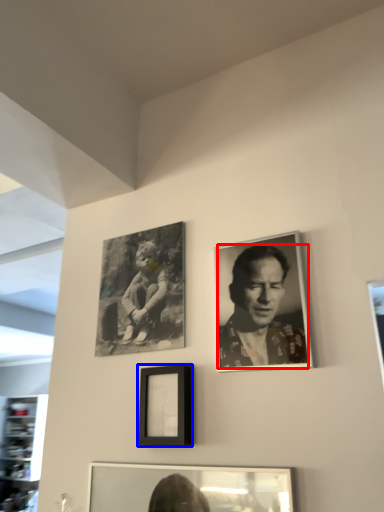
Question: Which object appears closest to the camera in this image, man (highlighted by a red box) or picture frame (highlighted by a blue box)?

Choices:
 (A) man
 (B) picture frame

Answer: (A)